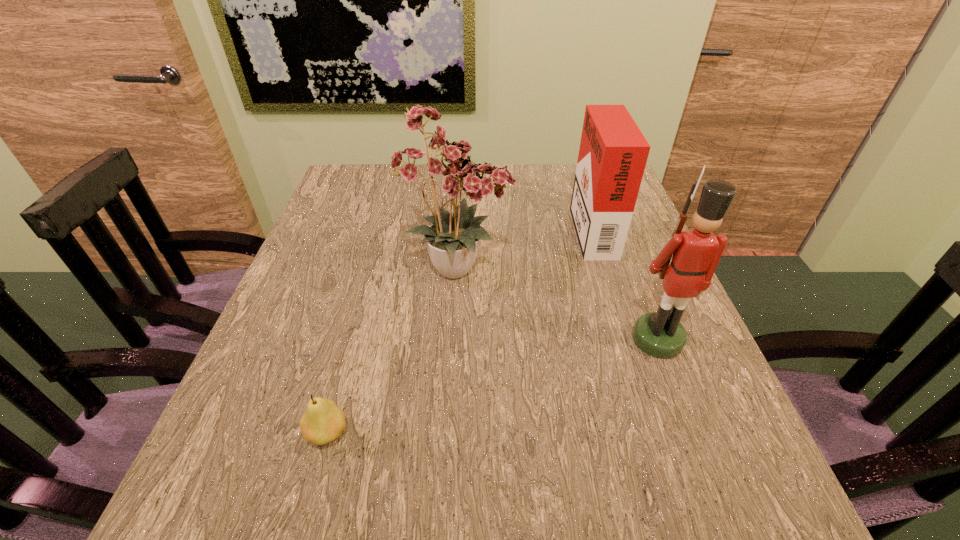
Identify which object is the closest to the pear. Please provide its 2D coordinates. Your answer should be formatted as a tuple, i.e. [(x, y)], where the tuple contains the x and y coordinates of a point satisfying the conditions above.

[(448, 170)]

The width and height of the screenshot is (960, 540). Identify the location of vacant space that satisfies the following two spatial constraints: 1. on the front-facing side of the flower arrangement; 2. on the front side of the pear. [x=449, y=433].